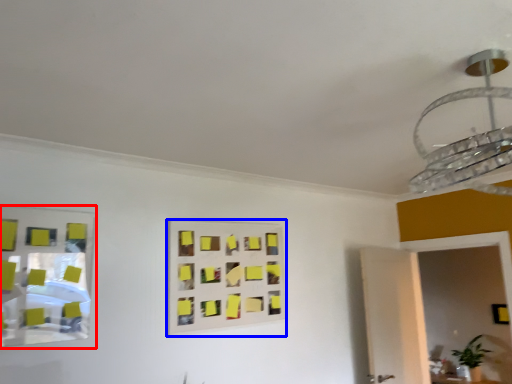
Question: Which object is closer to the camera taking this photo, mirror (highlighted by a red box) or rectangle (highlighted by a blue box)?

Choices:
 (A) mirror
 (B) rectangle

Answer: (A)